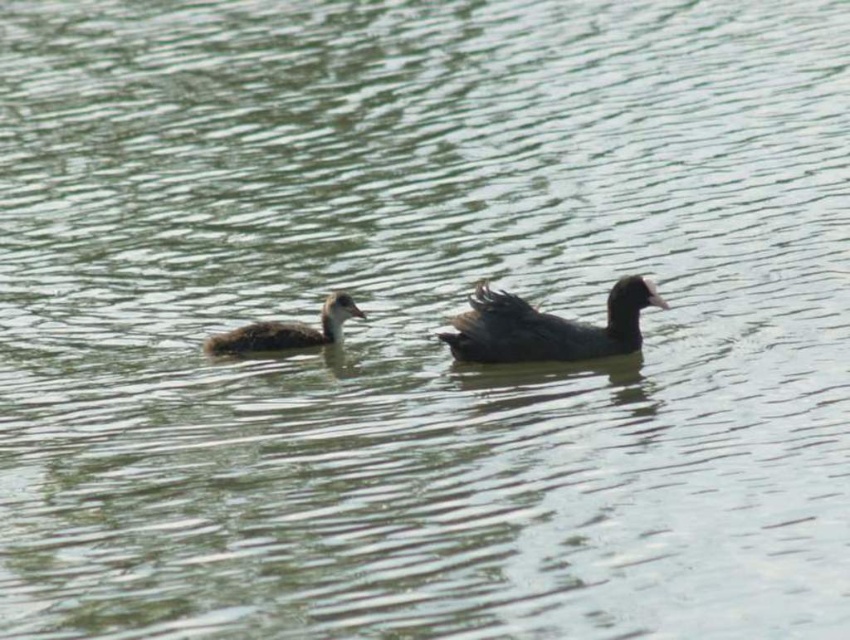
You are a photographer trying to capture the black matte duck at center. Your camera has a focus point at coordinate point (x=547, y=326). Will this focus point help you capture the duck clearly?

The black matte duck at center is located at point (x=547, y=326), so yes, the focus point at this coordinate will help capture the duck clearly.

You are a wildlife photographer trying to capture a photo of the black matte duck at center and the brown matte duckling at center. Since you want to ensure both are visible in the frame, which duck should you focus on first to account for their sizes?

The black matte duck at center is bigger than the brown matte duckling at center, so you should focus on the black matte duck at center first to ensure its larger size is properly framed before adjusting for the smaller duckling.